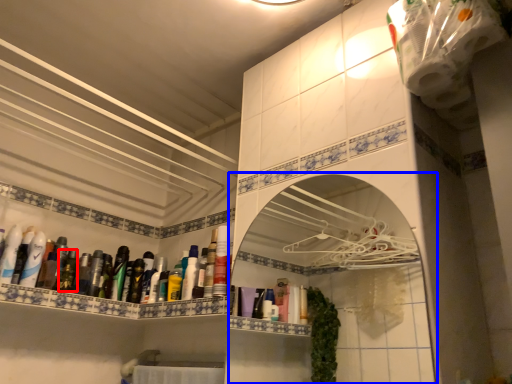
Question: Which object is further to the camera taking this photo, mouthwash (highlighted by a red box) or medicine cabinet (highlighted by a blue box)?

Choices:
 (A) mouthwash
 (B) medicine cabinet

Answer: (A)